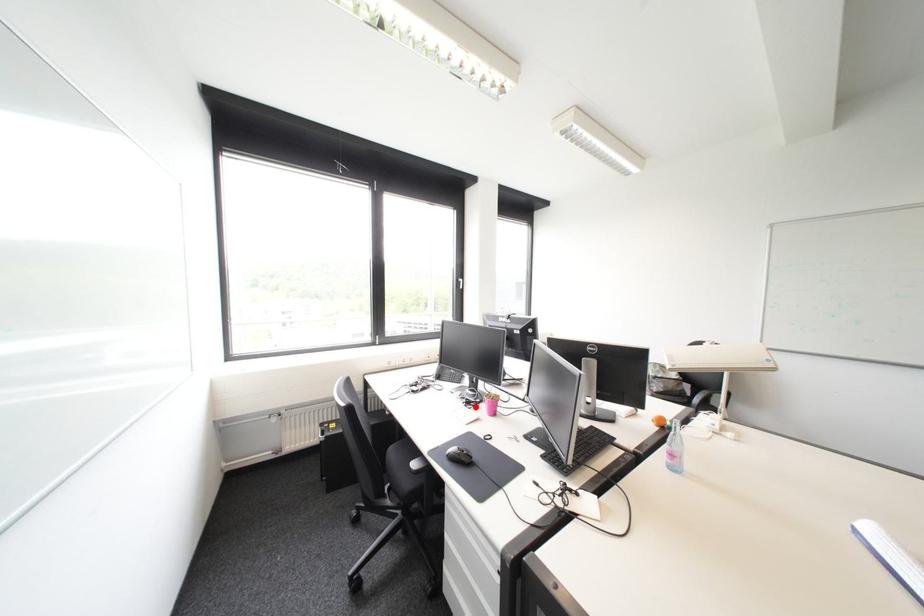
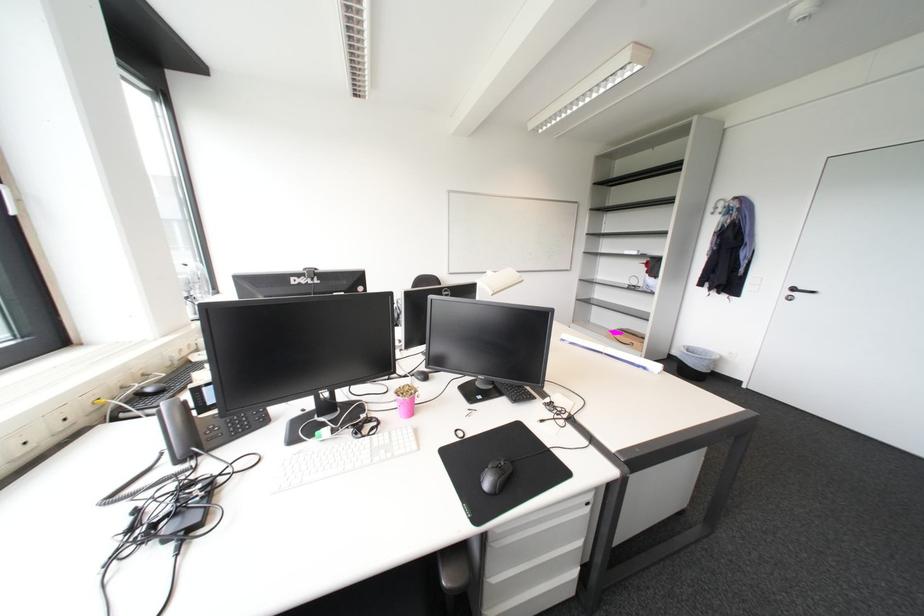
The point at the highlighted location is marked in the first image. Where is the corresponding point in the second image?

(379, 436)